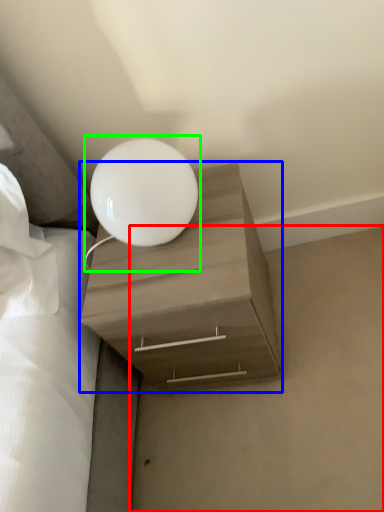
Question: Considering the real-world distances, which object is closest to concrete (highlighted by a red box)? nightstand (highlighted by a blue box) or lamp (highlighted by a green box).

Choices:
 (A) nightstand
 (B) lamp

Answer: (A)